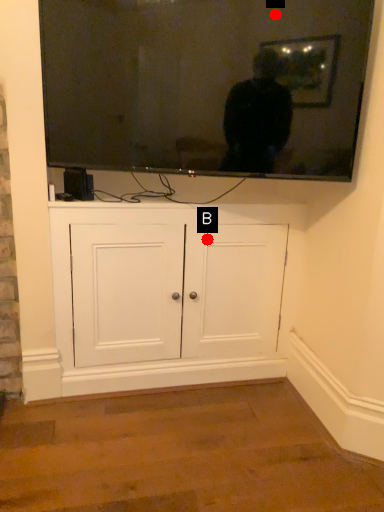
Question: Two points are circled on the image, labeled by A and B beside each circle. Which point is farther to the camera?

Choices:
 (A) A is further
 (B) B is further

Answer: (B)